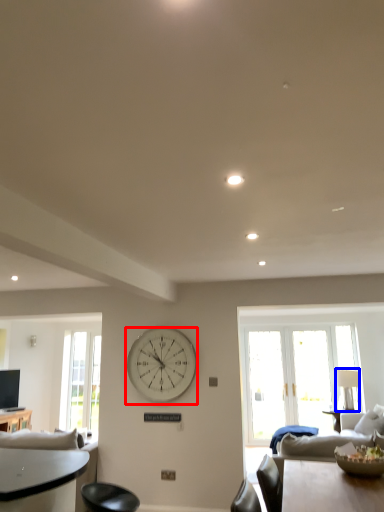
Question: Which point is further to the camera, wall clock (highlighted by a red box) or lamp (highlighted by a blue box)?

Choices:
 (A) wall clock
 (B) lamp

Answer: (B)